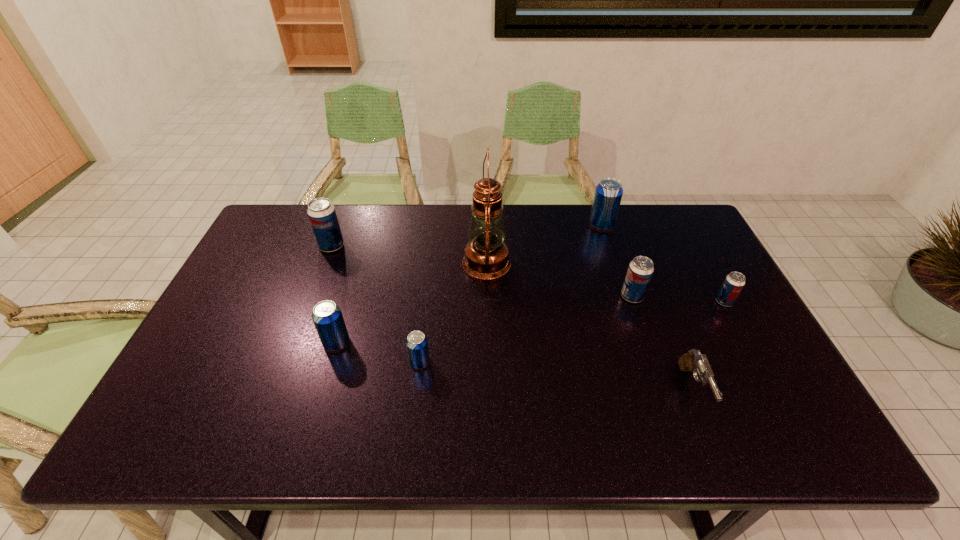
You are a GUI agent. You are given a task and a screenshot of the screen. Output one action in this format:
    pyautogui.click(x=<x>, y=<y>)
    Task: Click on the second object from right to left
    This screenshot has width=960, height=540.
    Given the screenshot: What is the action you would take?
    pyautogui.click(x=693, y=361)

Identify the location of the rightmost beer can. The image size is (960, 540). (734, 282).

Where is `the rightmost red beer can`? The width and height of the screenshot is (960, 540). the rightmost red beer can is located at coordinates (734, 282).

This screenshot has height=540, width=960. Find the location of `the nearest blue beer can`. the nearest blue beer can is located at coordinates (417, 344).

Identify the location of the third object from left to right. This screenshot has height=540, width=960. (417, 344).

Where is `free space located 0.210m on the back of the fourth object from left to right`? free space located 0.210m on the back of the fourth object from left to right is located at coordinates (486, 207).

Locate an element on the screen. This screenshot has height=540, width=960. vacant space located 0.060m on the front of the leftmost red beer can is located at coordinates (324, 267).

Identify the location of blank space located on the front of the biggest blue beer can. (620, 282).

The width and height of the screenshot is (960, 540). In order to click on free space located on the right of the second smallest red beer can in this screenshot , I will do `click(737, 296)`.

Where is `vacant space situated on the right of the second beer can from left to right`? vacant space situated on the right of the second beer can from left to right is located at coordinates (484, 342).